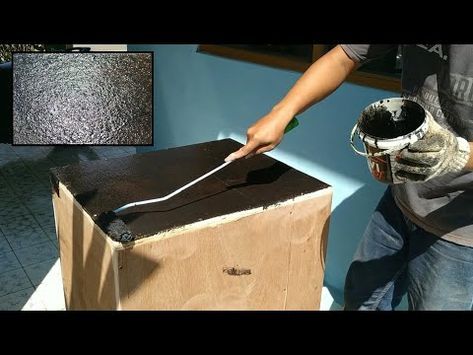
The width and height of the screenshot is (473, 355). Identify the location of space to the left of table. (42, 221).